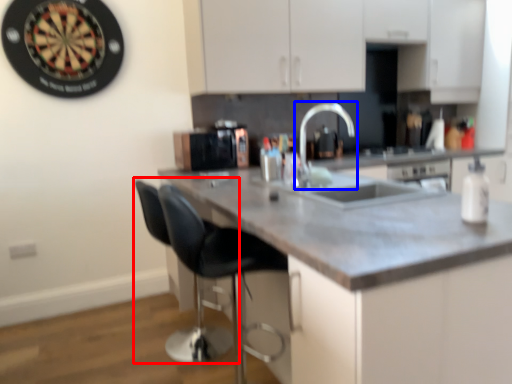
Question: Which object appears closest to the camera in this image, swivel chair (highlighted by a red box) or tap (highlighted by a blue box)?

Choices:
 (A) swivel chair
 (B) tap

Answer: (B)